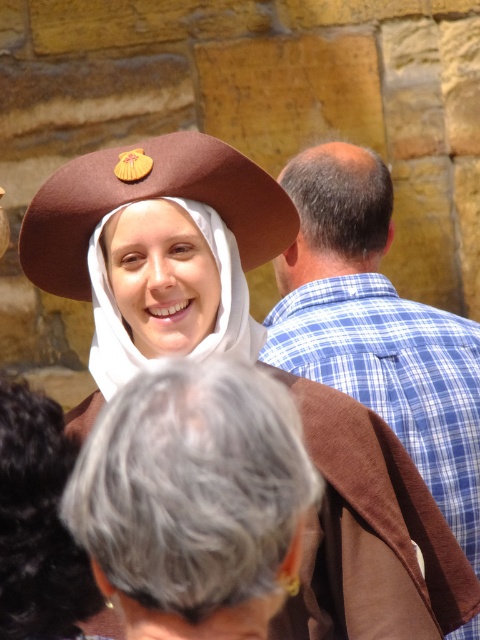
Question: Which object is the farthest from the brown felt hat at upper center?

Choices:
 (A) blue plaid shirt at right
 (B) brown felt hat at center
 (C) brown hair at center

Answer: (A)

Question: Is brown felt hat at upper center positioned before brown hair at center?

Choices:
 (A) no
 (B) yes

Answer: (B)

Question: Which of the following is the closest to the observer?

Choices:
 (A) (x=98, y=198)
 (B) (x=407, y=420)
 (C) (x=110, y=376)
 (D) (x=310, y=211)

Answer: (A)

Question: Does blue plaid shirt at right have a larger size compared to brown felt hat at upper center?

Choices:
 (A) no
 (B) yes

Answer: (B)

Question: Among these objects, which one is farthest from the camera?

Choices:
 (A) brown hair at center
 (B) brown felt hat at upper center
 (C) brown felt hat at center
 (D) blue plaid shirt at right

Answer: (A)

Question: In this image, where is brown hair at center located relative to brown felt hat at center?

Choices:
 (A) above
 (B) below

Answer: (A)